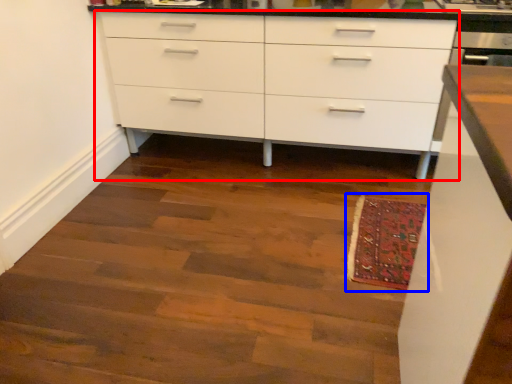
Question: Which of the following is the closest to the observer, chest of drawers (highlighted by a red box) or mat (highlighted by a blue box)?

Choices:
 (A) chest of drawers
 (B) mat

Answer: (B)